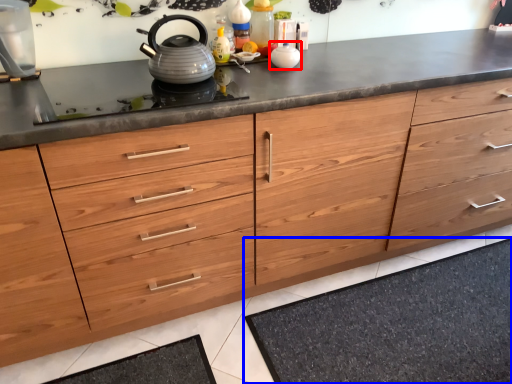
Question: Which object appears farthest to the camera in this image, appliance (highlighted by a red box) or bath mat (highlighted by a blue box)?

Choices:
 (A) appliance
 (B) bath mat

Answer: (A)